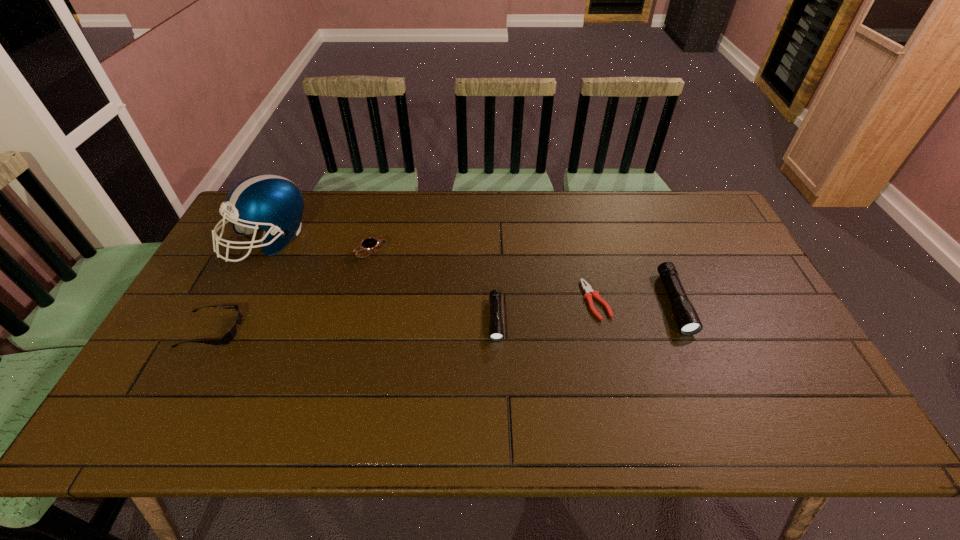
What are the coordinates of `free space that satisfies the following two spatial constraints: 1. at the front of the football helmet with the faceguard; 2. on the right side of the pliers` in the screenshot? It's located at (237, 300).